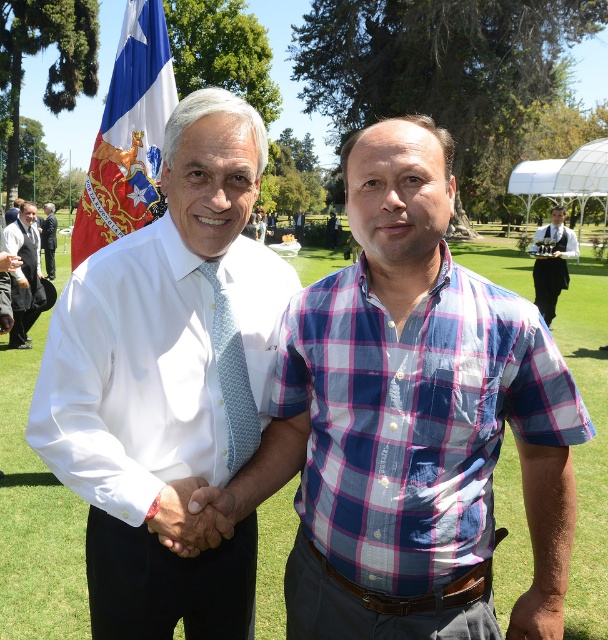
Question: Does dark gray suit at left lie behind black uniform at right?

Choices:
 (A) no
 (B) yes

Answer: (A)

Question: Is blue fabric flag at upper left positioned behind dark gray suit at left?

Choices:
 (A) no
 (B) yes

Answer: (A)

Question: Which of the following is the farthest from the observer?

Choices:
 (A) blue plaid shirt at center
 (B) black uniform at right

Answer: (B)

Question: Among these points, which one is nearest to the camera?

Choices:
 (A) tap(22, 284)
 (B) tap(43, 227)

Answer: (A)

Question: Which point is farther from the camera taking this photo?

Choices:
 (A) (206, 304)
 (B) (358, 608)
 (C) (15, 324)
 (D) (50, 237)

Answer: (D)

Question: Considering the relative positions of blue textured tie at center and black uniform at right in the image provided, where is blue textured tie at center located with respect to black uniform at right?

Choices:
 (A) above
 (B) below

Answer: (B)